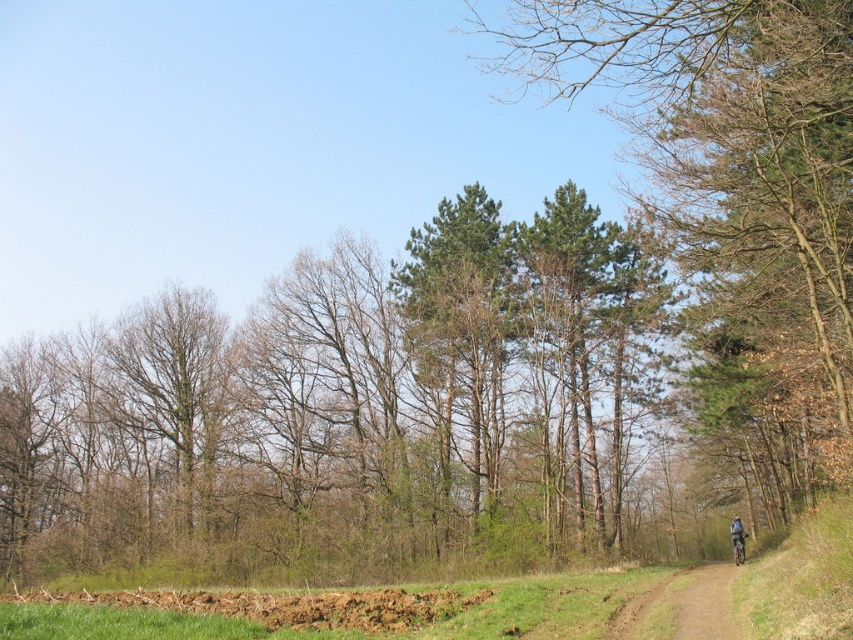
You are standing at the center of the image and want to walk to the brown dirt track at lower right. Which direction should you head?

The brown dirt track at lower right is located at coordinates point (682, 605), so you should head towards the lower right direction to reach it.

From the picture: You are standing at the start of the dirt path and see the brown dirt track at lower right and the shiny blue frame at right. Which object is closer to your left side?

The brown dirt track at lower right is to the left of the shiny blue frame at right, so it is closer to your left side.

You are standing at the edge of the dirt path and want to take a photo of the green leafy tree at center. If your camera has a maximum zoom range of 50 feet, will you be able to capture the tree clearly without moving closer?

The green leafy tree at center is 52.07 feet away from the viewer. Since the camera can only zoom up to 50 feet, you won cannot capture the tree clearly without moving closer.